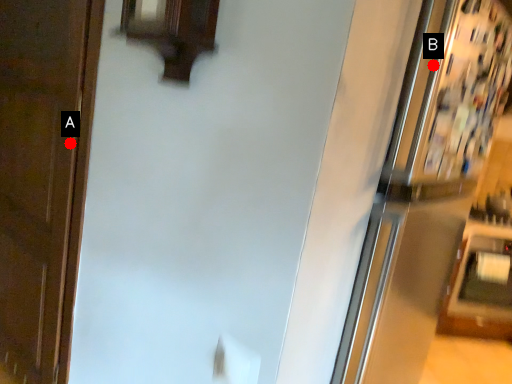
Question: Two points are circled on the image, labeled by A and B beside each circle. Which point is farther from the camera taking this photo?

Choices:
 (A) A is further
 (B) B is further

Answer: (A)